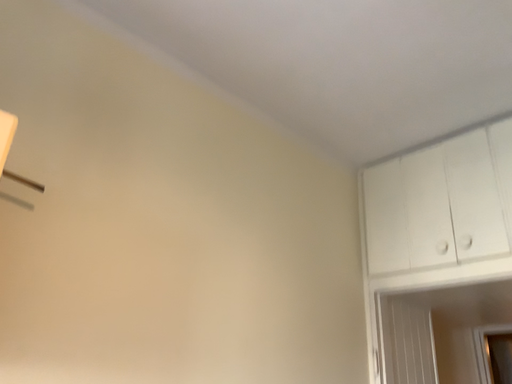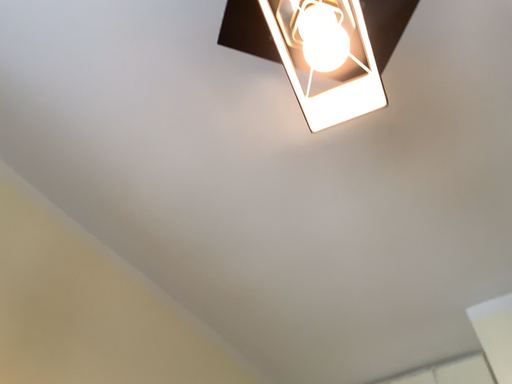
Question: How did the camera likely rotate when shooting the video?

Choices:
 (A) rotated downward
 (B) rotated upward

Answer: (B)